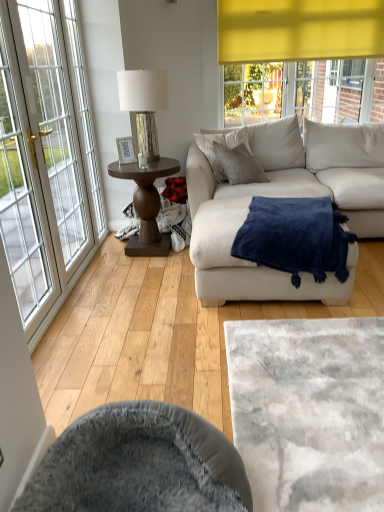
Question: Should I look upward or downward to see metallic silver table lamp at center left?

Choices:
 (A) down
 (B) up

Answer: (B)

Question: Is beige fabric couch at center located outside velvet grey swivel chair at lower center?

Choices:
 (A) yes
 (B) no

Answer: (A)

Question: Can you confirm if beige fabric couch at center is taller than velvet grey swivel chair at lower center?

Choices:
 (A) yes
 (B) no

Answer: (A)

Question: Can you confirm if beige fabric couch at center is wider than velvet grey swivel chair at lower center?

Choices:
 (A) yes
 (B) no

Answer: (A)

Question: Considering the relative positions of beige fabric couch at center and velvet grey swivel chair at lower center in the image provided, is beige fabric couch at center to the left of velvet grey swivel chair at lower center from the viewer's perspective?

Choices:
 (A) no
 (B) yes

Answer: (A)

Question: Is beige fabric couch at center bigger than velvet grey swivel chair at lower center?

Choices:
 (A) yes
 (B) no

Answer: (A)

Question: Is beige fabric couch at center smaller than velvet grey swivel chair at lower center?

Choices:
 (A) no
 (B) yes

Answer: (A)

Question: From a real-world perspective, is velvety gray cat bed at lower center located beneath white glass window at left?

Choices:
 (A) yes
 (B) no

Answer: (A)

Question: Is velvety gray cat bed at lower center positioned before white glass window at left?

Choices:
 (A) yes
 (B) no

Answer: (A)

Question: Would you say velvety gray cat bed at lower center is a long distance from white glass window at left?

Choices:
 (A) yes
 (B) no

Answer: (A)

Question: Is velvety gray cat bed at lower center positioned behind white glass window at left?

Choices:
 (A) no
 (B) yes

Answer: (A)

Question: From a real-world perspective, is velvety gray cat bed at lower center located higher than white glass window at left?

Choices:
 (A) no
 (B) yes

Answer: (A)

Question: Can you confirm if velvety gray cat bed at lower center is shorter than white glass window at left?

Choices:
 (A) yes
 (B) no

Answer: (A)

Question: Can you confirm if velvet grey swivel chair at lower center is thinner than dark brown wood side table at center left?

Choices:
 (A) no
 (B) yes

Answer: (A)